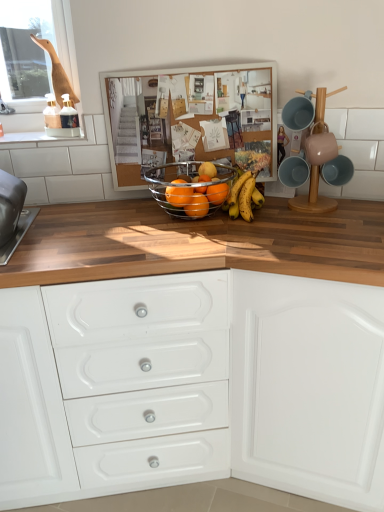
Find the location of a particular element. This screenshot has width=384, height=512. free space above white matte cabinet at center (from a real-world perspective) is located at coordinates (319, 224).